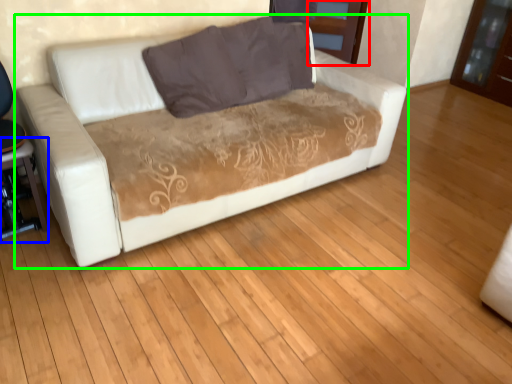
Question: Which object is positioned closest to dresser (highlighted by a red box)? Select from table (highlighted by a blue box) and studio couch (highlighted by a green box).

Choices:
 (A) table
 (B) studio couch

Answer: (B)